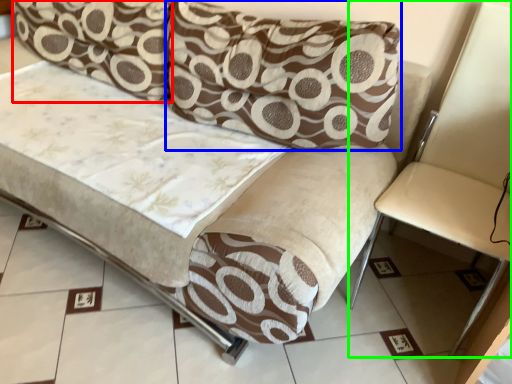
Question: Which object is the farthest from pillow (highlighted by a red box)? Choose among these: pillow (highlighted by a blue box) or armchair (highlighted by a green box).

Choices:
 (A) pillow
 (B) armchair

Answer: (B)